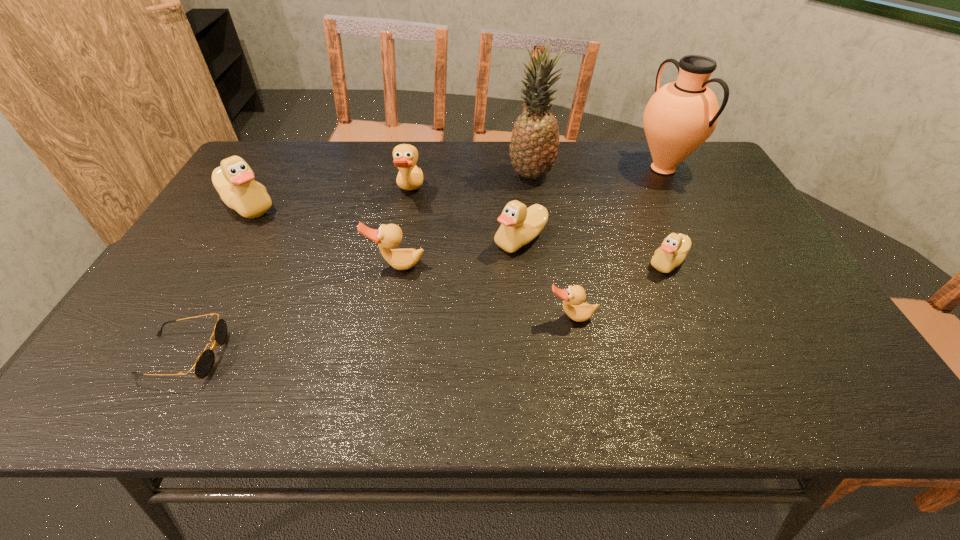
Locate an element on the screen. vacant space at the near left corner of the desktop is located at coordinates (144, 376).

I want to click on vacant space at the far right corner of the desktop, so click(707, 151).

Image resolution: width=960 pixels, height=540 pixels. I want to click on blank region between the biggest tan duck and the nearest tan duck, so click(491, 254).

Where is `free space between the smallest beige duck and the nearest tan duck`? free space between the smallest beige duck and the nearest tan duck is located at coordinates (619, 289).

Identify the location of free spot between the rightmost duck and the second farthest tan duck. This screenshot has width=960, height=540. (532, 264).

This screenshot has width=960, height=540. I want to click on free spot between the pitcher and the second biggest beige duck, so click(x=591, y=204).

At what (x,y) coordinates should I click in order to perform the action: click on vacant region between the biggest beige duck and the smallest beige duck. Please return your answer as a coordinate pair (x, y). Looking at the image, I should click on (458, 233).

Locate an element on the screen. This screenshot has height=540, width=960. vacant area that lies between the shortest object and the rightmost beige duck is located at coordinates (426, 308).

This screenshot has height=540, width=960. In order to click on free area in between the second biggest beige duck and the leftmost beige duck in this screenshot , I will do `click(384, 222)`.

What are the coordinates of `vacant space that's between the rightmost beige duck and the nearest object` in the screenshot? It's located at (426, 308).